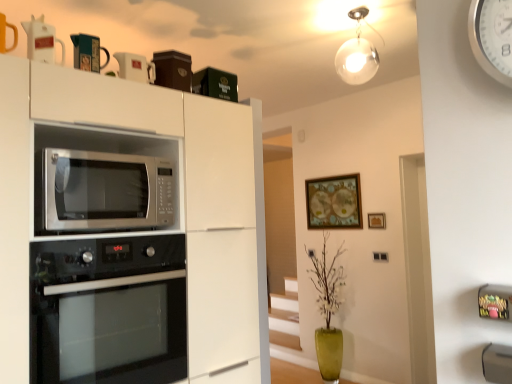
Question: In the image, is satin silver microwave at center positioned in front of or behind matte black mug at upper center, which appears as the 2th appliance when viewed from the back?

Choices:
 (A) behind
 (B) front

Answer: (B)

Question: From the image's perspective, is satin silver microwave at center located above or below matte black mug at upper center, which appears as the 2th appliance when viewed from the back?

Choices:
 (A) below
 (B) above

Answer: (A)

Question: Estimate the real-world distances between objects in this image. Which object is farther from the white matte cabinet at upper center?

Choices:
 (A) wooden framed map at upper center, placed as the second picture frame when sorted from right to left
 (B) matte black mug at upper center, which appears as the 2th appliance when viewed from the back
 (C) white plastic clock at upper right
 (D) black glass oven at lower left
 (E) satin silver microwave at center

Answer: (A)

Question: Which of these objects is positioned farthest from the wooden picture frame at upper center, the 1th picture frame viewed from the front?

Choices:
 (A) white plastic clock at upper right
 (B) matte black mug at upper center, arranged as the 2th appliance when viewed from the front
 (C) white matte cabinet at upper center
 (D) black glass oven at lower left
 (E) satin silver microwave at center

Answer: (A)